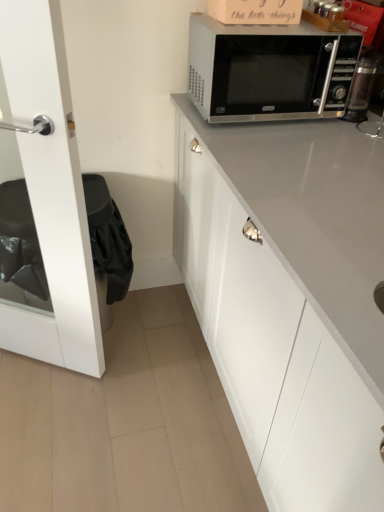
Find the location of `vacant area situated below white glossy door at left (from a real-world perspective)`. vacant area situated below white glossy door at left (from a real-world perspective) is located at coordinates (55, 370).